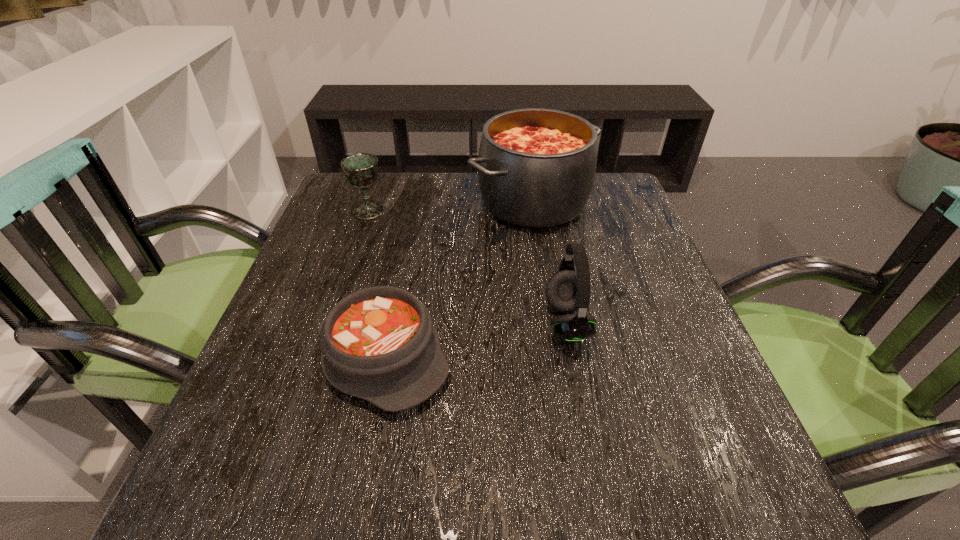
Locate an element on the screen. Image resolution: width=960 pixels, height=540 pixels. free spot at the near edge of the desktop is located at coordinates (598, 484).

The width and height of the screenshot is (960, 540). I want to click on vacant space at the left edge of the desktop, so click(364, 288).

The height and width of the screenshot is (540, 960). In the image, there is a desktop. Identify the location of vacant space at the right edge. (689, 416).

The height and width of the screenshot is (540, 960). In the image, there is a desktop. Identify the location of free space at the far left corner. (337, 186).

Where is `blank space at the near left corner`? The image size is (960, 540). blank space at the near left corner is located at coordinates (245, 484).

You are a GUI agent. You are given a task and a screenshot of the screen. Output one action in this format:
    pyautogui.click(x=<x>, y=<y>)
    Task: Click on the vacant space at the far right corner
    
    Given the screenshot: What is the action you would take?
    pyautogui.click(x=595, y=197)

Where is `free region at the near right corner of the desktop`? This screenshot has width=960, height=540. free region at the near right corner of the desktop is located at coordinates (685, 477).

In order to click on vacant region between the third tallest object and the right casserole in this screenshot , I will do `click(451, 206)`.

The height and width of the screenshot is (540, 960). In order to click on vacant region between the shortest object and the right casserole in this screenshot , I will do `click(458, 279)`.

Where is `free space between the second tallest object and the third tallest object`? free space between the second tallest object and the third tallest object is located at coordinates (468, 267).